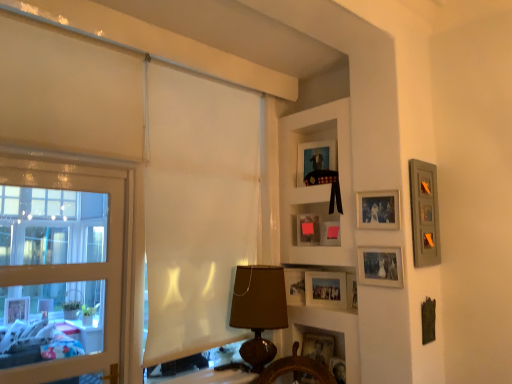
Question: Does matte pink picture frame at center, acting as the fifth picture frame starting from the bottom, appear on the right side of wooden picture frame at lower center, the first picture frame when ordered from bottom to top?

Choices:
 (A) no
 (B) yes

Answer: (A)

Question: Would you say matte pink picture frame at center, the 5th picture frame from the top, is outside wooden picture frame at lower center, the first picture frame when ordered from bottom to top?

Choices:
 (A) yes
 (B) no

Answer: (A)

Question: Considering the relative sizes of matte pink picture frame at center, acting as the fifth picture frame starting from the bottom, and wooden picture frame at lower center, which appears as the 9th picture frame when viewed from the top, in the image provided, is matte pink picture frame at center, acting as the fifth picture frame starting from the bottom, wider than wooden picture frame at lower center, which appears as the 9th picture frame when viewed from the top,?

Choices:
 (A) yes
 (B) no

Answer: (B)

Question: Does matte pink picture frame at center, the 5th picture frame from the top, come in front of wooden picture frame at lower center, which appears as the 9th picture frame when viewed from the top?

Choices:
 (A) yes
 (B) no

Answer: (B)

Question: From a real-world perspective, is matte pink picture frame at center, the 5th picture frame from the top, positioned under wooden picture frame at lower center, which appears as the 9th picture frame when viewed from the top, based on gravity?

Choices:
 (A) yes
 (B) no

Answer: (B)

Question: Is point (356, 210) positioned closer to the camera than point (345, 284)?

Choices:
 (A) closer
 (B) farther

Answer: (A)

Question: Is matte silver photo frame at upper right, which is the second picture frame from top to bottom, inside or outside of matte silver picture frame at center, which is counted as the 3th picture frame, starting from the bottom?

Choices:
 (A) outside
 (B) inside

Answer: (A)

Question: Considering the positions of matte silver photo frame at upper right, acting as the 8th picture frame starting from the bottom, and matte silver picture frame at center, which is counted as the seventh picture frame, starting from the top, in the image, is matte silver photo frame at upper right, acting as the 8th picture frame starting from the bottom, wider or thinner than matte silver picture frame at center, which is counted as the seventh picture frame, starting from the top,?

Choices:
 (A) thin
 (B) wide

Answer: (A)

Question: From a real-world perspective, relative to matte silver picture frame at center, which is counted as the seventh picture frame, starting from the top, is matte silver photo frame at upper right, which is the second picture frame from top to bottom, vertically above or below?

Choices:
 (A) below
 (B) above

Answer: (B)

Question: Is point 338,240 closer or farther from the camera than point 47,304?

Choices:
 (A) farther
 (B) closer

Answer: (B)

Question: Considering the positions of matte pink picture frame at center, acting as the fifth picture frame starting from the bottom, and wooden frame window at left in the image, is matte pink picture frame at center, acting as the fifth picture frame starting from the bottom, wider or thinner than wooden frame window at left?

Choices:
 (A) thin
 (B) wide

Answer: (A)

Question: Choose the correct answer: Is matte pink picture frame at center, the 5th picture frame from the top, inside wooden frame window at left or outside it?

Choices:
 (A) inside
 (B) outside

Answer: (B)

Question: Is matte pink picture frame at center, the 5th picture frame from the top, taller or shorter than wooden frame window at left?

Choices:
 (A) short
 (B) tall

Answer: (A)

Question: Looking at their shapes, would you say wooden ship's wheel at lower center, the second shelf positioned from the top, is wider or thinner than wooden frame window at left?

Choices:
 (A) thin
 (B) wide

Answer: (B)

Question: From their relative heights in the image, would you say wooden ship's wheel at lower center, the second shelf positioned from the top, is taller or shorter than wooden frame window at left?

Choices:
 (A) tall
 (B) short

Answer: (B)